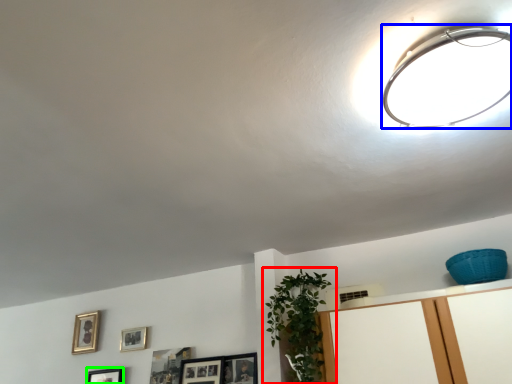
Question: Considering the real-world distances, which object is closest to houseplant (highlighted by a red box)? lamp (highlighted by a blue box) or picture frame (highlighted by a green box).

Choices:
 (A) lamp
 (B) picture frame

Answer: (A)